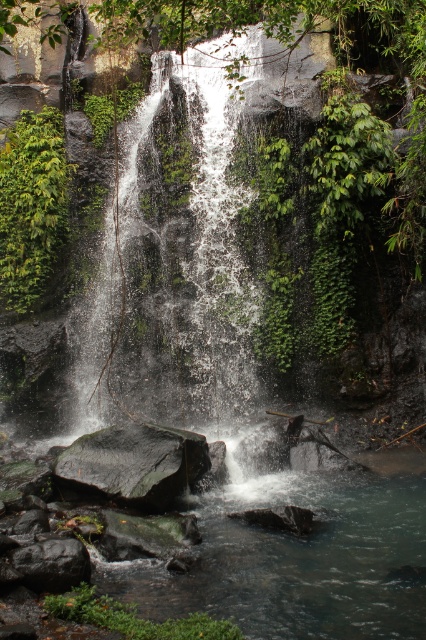
Question: Is green mossy rock at lower center smaller than dark gray rock at lower left?

Choices:
 (A) yes
 (B) no

Answer: (B)

Question: Is green leafy plant at left smaller than dark gray rock at lower left?

Choices:
 (A) no
 (B) yes

Answer: (A)

Question: In this image, where is green leafy plant at left located relative to black smooth rock at center?

Choices:
 (A) above
 (B) below

Answer: (A)

Question: Which point appears farthest from the camera in this image?

Choices:
 (A) (63, 552)
 (B) (66, 168)
 (C) (154, 632)
 (D) (152, 467)

Answer: (B)

Question: Which object is positioned closest to the green mossy rock at lower center?

Choices:
 (A) dark gray rock at lower left
 (B) black smooth rock at center
 (C) green leafy plant at left

Answer: (A)

Question: Which point is closer to the camera?

Choices:
 (A) black smooth rock at center
 (B) green mossy rock at lower center

Answer: (B)